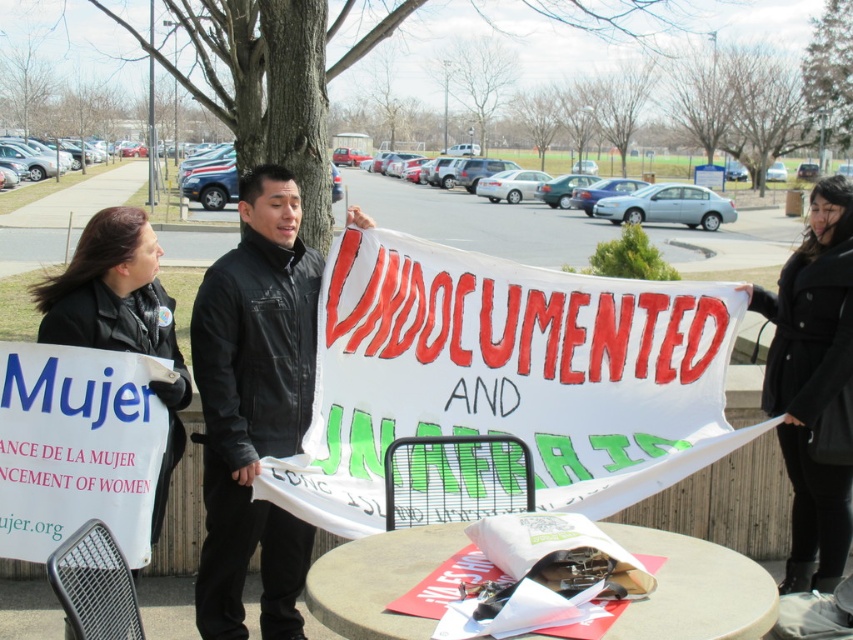
Question: Can you confirm if black wool coat at right is wider than concrete table at center?

Choices:
 (A) no
 (B) yes

Answer: (A)

Question: Which point is farther to the camera?

Choices:
 (A) (314, 588)
 (B) (820, 326)
 (C) (93, 298)
 (D) (201, 387)

Answer: (B)

Question: Can you confirm if black wool coat at right is smaller than concrete table at center?

Choices:
 (A) yes
 (B) no

Answer: (B)

Question: Is black wool coat at right above concrete table at center?

Choices:
 (A) no
 (B) yes

Answer: (B)

Question: Among these points, which one is nearest to the camera?

Choices:
 (A) (236, 568)
 (B) (669, 563)
 (C) (776, 365)

Answer: (B)

Question: Which point is farther from the camera taking this photo?

Choices:
 (A) (671, 564)
 (B) (167, 452)

Answer: (B)